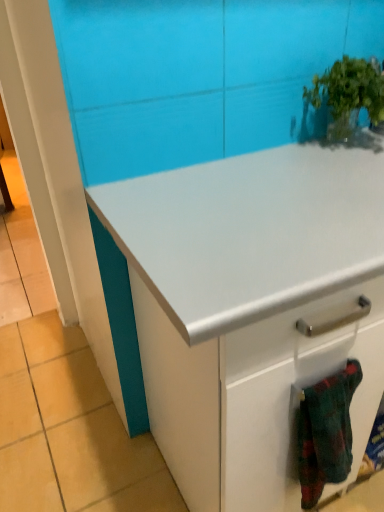
Where is `green leafy plant at upper right`? The height and width of the screenshot is (512, 384). green leafy plant at upper right is located at coordinates (348, 95).

What is the approximate width of flannel fabric blanket at lower right?

The width of flannel fabric blanket at lower right is 3.67 inches.

Describe the element at coordinates (251, 308) in the screenshot. I see `white glossy cabinet at center` at that location.

In order to click on green leafy plant at upper right in this screenshot , I will do `click(348, 95)`.

Is point (325, 417) behind point (346, 60)?

That is False.

From the picture: Is flannel fabric blanket at lower right turned away from green leafy plant at upper right?

No, flannel fabric blanket at lower right is not facing the opposite direction of green leafy plant at upper right.

From the image's perspective, is flannel fabric blanket at lower right beneath green leafy plant at upper right?

Yes, from the image's perspective, flannel fabric blanket at lower right is beneath green leafy plant at upper right.

Between flannel fabric blanket at lower right and green leafy plant at upper right, which one has less height?

green leafy plant at upper right.

From a real-world perspective, is white glossy cabinet at center located beneath green leafy plant at upper right?

Correct, in the physical world, white glossy cabinet at center is lower than green leafy plant at upper right.

From the image's perspective, is white glossy cabinet at center below green leafy plant at upper right?

Yes, from the image's perspective, white glossy cabinet at center is beneath green leafy plant at upper right.

How different are the orientations of white glossy cabinet at center and green leafy plant at upper right in degrees?

The facing directions of white glossy cabinet at center and green leafy plant at upper right are 1.33 degrees apart.

I want to click on cabinetry beneath the green leafy plant at upper right (from a real-world perspective), so click(251, 308).

Based on the photo, who is smaller, green leafy plant at upper right or flannel fabric blanket at lower right?

flannel fabric blanket at lower right is smaller.

Would you consider green leafy plant at upper right to be distant from flannel fabric blanket at lower right?

No, green leafy plant at upper right is not far away from flannel fabric blanket at lower right.

From a real-world perspective, is green leafy plant at upper right positioned under flannel fabric blanket at lower right based on gravity?

Actually, green leafy plant at upper right is physically above flannel fabric blanket at lower right in the real world.

Who is taller, green leafy plant at upper right or flannel fabric blanket at lower right?

With more height is flannel fabric blanket at lower right.

Considering the sizes of objects white glossy cabinet at center and flannel fabric blanket at lower right in the image provided, who is taller, white glossy cabinet at center or flannel fabric blanket at lower right?

white glossy cabinet at center is taller.

How far apart are white glossy cabinet at center and flannel fabric blanket at lower right?

7.85 inches.

Considering the sizes of white glossy cabinet at center and flannel fabric blanket at lower right in the image, is white glossy cabinet at center bigger or smaller than flannel fabric blanket at lower right?

Considering their sizes, white glossy cabinet at center takes up more space than flannel fabric blanket at lower right.

From a real-world perspective, is white glossy cabinet at center physically above flannel fabric blanket at lower right?

Incorrect, from a real-world perspective, white glossy cabinet at center is lower than flannel fabric blanket at lower right.

From the image's perspective, is flannel fabric blanket at lower right above or below white glossy cabinet at center?

flannel fabric blanket at lower right is situated lower than white glossy cabinet at center in the image.

From a real-world perspective, does flannel fabric blanket at lower right sit lower than white glossy cabinet at center?

No, from a real-world perspective, flannel fabric blanket at lower right is not under white glossy cabinet at center.

This screenshot has height=512, width=384. Identify the location of blanket to the left of white glossy cabinet at center. (326, 432).

What's the angular difference between flannel fabric blanket at lower right and white glossy cabinet at center's facing directions?

1.19 degrees.

In terms of size, does green leafy plant at upper right appear bigger or smaller than white glossy cabinet at center?

In the image, green leafy plant at upper right appears to be smaller than white glossy cabinet at center.

Is green leafy plant at upper right located outside white glossy cabinet at center?

Indeed, green leafy plant at upper right is completely outside white glossy cabinet at center.

Between green leafy plant at upper right and white glossy cabinet at center, which one has more height?

With more height is white glossy cabinet at center.

Where is `blanket beneath the green leafy plant at upper right (from a real-world perspective)`? The width and height of the screenshot is (384, 512). blanket beneath the green leafy plant at upper right (from a real-world perspective) is located at coordinates (326, 432).

I want to click on cabinetry in front of the green leafy plant at upper right, so click(251, 308).

Based on their spatial positions, is green leafy plant at upper right or white glossy cabinet at center closer to flannel fabric blanket at lower right?

white glossy cabinet at center lies closer to flannel fabric blanket at lower right than the other object.

Estimate the real-world distances between objects in this image. Which object is closer to white glossy cabinet at center, flannel fabric blanket at lower right or green leafy plant at upper right?

Among the two, flannel fabric blanket at lower right is located nearer to white glossy cabinet at center.

Considering their positions, is white glossy cabinet at center positioned closer to green leafy plant at upper right than flannel fabric blanket at lower right?

white glossy cabinet at center is positioned closer to the anchor green leafy plant at upper right.

Considering their positions, is flannel fabric blanket at lower right positioned closer to green leafy plant at upper right than white glossy cabinet at center?

The object closer to green leafy plant at upper right is white glossy cabinet at center.

Considering their positions, is white glossy cabinet at center positioned closer to flannel fabric blanket at lower right than green leafy plant at upper right?

white glossy cabinet at center is positioned closer to the anchor flannel fabric blanket at lower right.

Which object lies further to the anchor point white glossy cabinet at center, green leafy plant at upper right or flannel fabric blanket at lower right?

green leafy plant at upper right is further to white glossy cabinet at center.

The image size is (384, 512). I want to click on cabinetry between green leafy plant at upper right and flannel fabric blanket at lower right in the up-down direction, so click(251, 308).